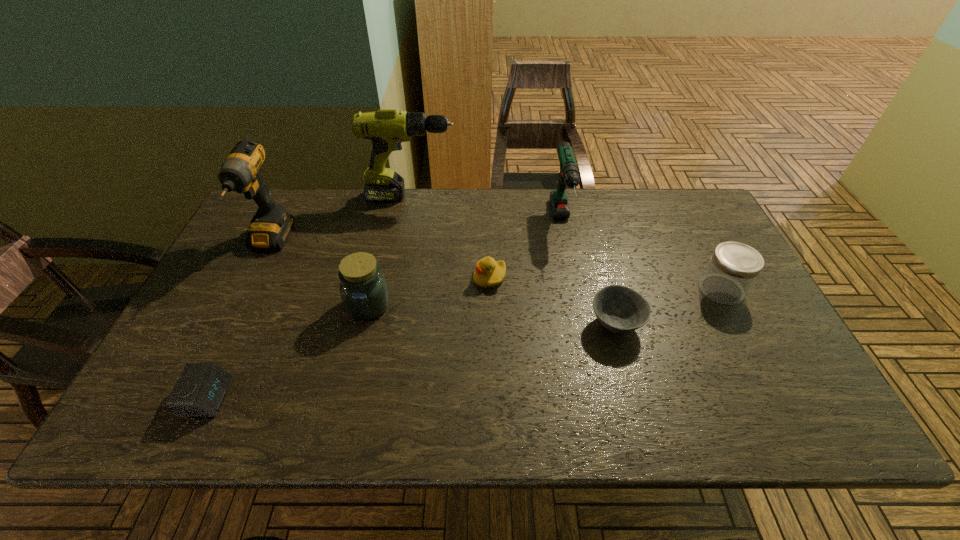
Identify the location of vacant space at the far right corner of the desktop. The height and width of the screenshot is (540, 960). (711, 220).

At what (x,y) coordinates should I click in order to perform the action: click on vacant space that is in between the second drill from left to right and the duckling. Please return your answer as a coordinate pair (x, y). Image resolution: width=960 pixels, height=540 pixels. Looking at the image, I should click on (450, 238).

Find the location of a particular element. vacant space in between the bowl and the fourth tallest object is located at coordinates (492, 315).

The image size is (960, 540). Find the location of `blank region between the fourth object from right to left and the left jar`. blank region between the fourth object from right to left and the left jar is located at coordinates (429, 292).

Locate an element on the screen. The width and height of the screenshot is (960, 540). free space that is in between the fifth object from left to right and the fourth tallest object is located at coordinates (429, 292).

Image resolution: width=960 pixels, height=540 pixels. Find the location of `free space that is in between the fourth object from right to left and the fourth tallest object`. free space that is in between the fourth object from right to left and the fourth tallest object is located at coordinates (429, 292).

Locate an element on the screen. free point between the fifth tallest object and the taller jar is located at coordinates (544, 298).

Find the location of a particular element. This screenshot has width=960, height=540. free space between the fourth tallest object and the rightmost drill is located at coordinates (465, 264).

This screenshot has width=960, height=540. I want to click on vacant area that lies between the duckling and the bowl, so (x=553, y=301).

The width and height of the screenshot is (960, 540). What are the coordinates of `unoccupied position between the second drill from right to left and the shorter jar` in the screenshot? It's located at (566, 243).